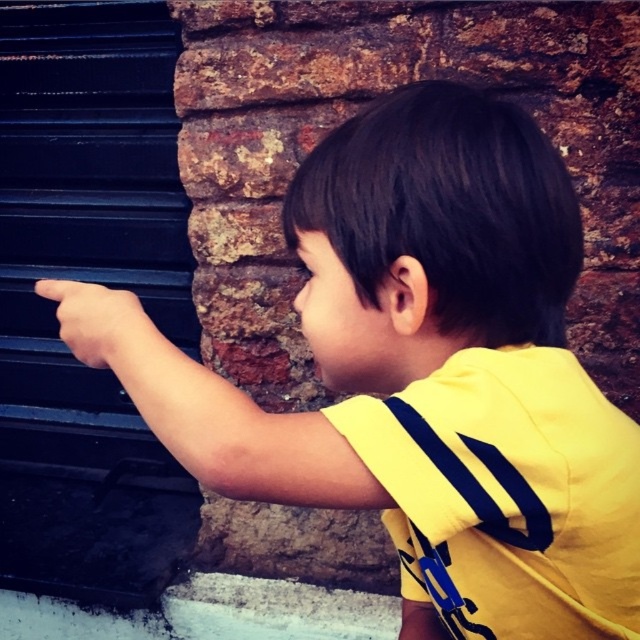
Question: Does black matte garage door at left come in front of smooth skin hand at left?

Choices:
 (A) no
 (B) yes

Answer: (A)

Question: Which object is closer to the camera taking this photo?

Choices:
 (A) smooth skin hand at left
 (B) black matte garage door at left

Answer: (A)

Question: Which object appears farthest from the camera in this image?

Choices:
 (A) smooth skin hand at left
 (B) black matte garage door at left

Answer: (B)

Question: Is black matte garage door at left above smooth skin hand at left?

Choices:
 (A) yes
 (B) no

Answer: (A)

Question: Can you confirm if black matte garage door at left is positioned to the left of smooth skin hand at left?

Choices:
 (A) yes
 (B) no

Answer: (A)